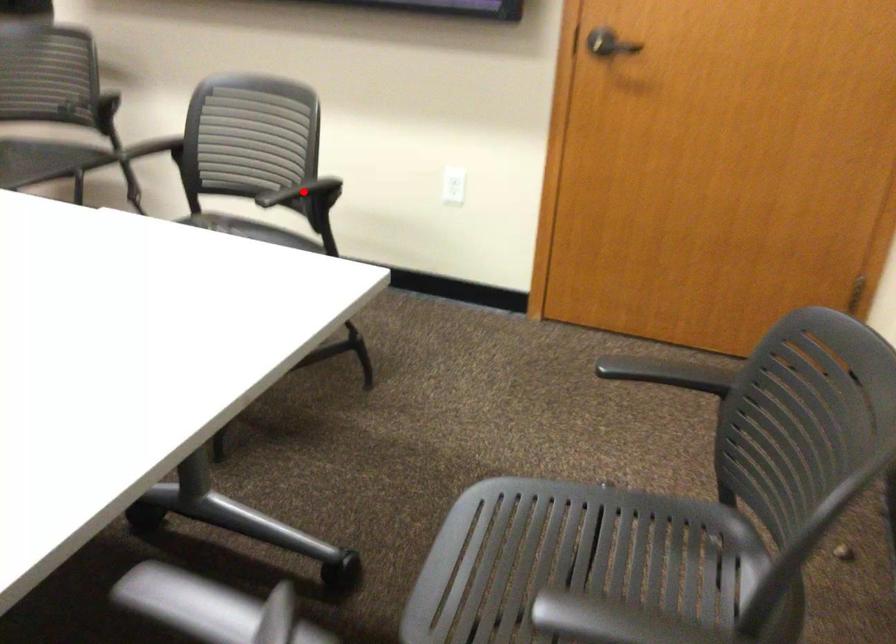
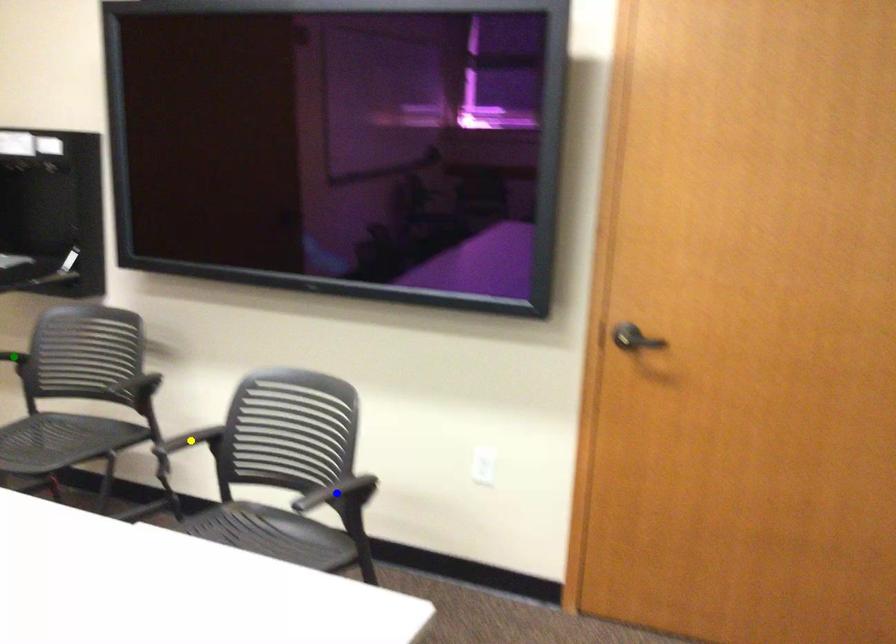
Question: I am providing you with two images of the same scene from different viewpoints. A red point is marked on the first image. You are given multiple points on the second image. Which point in image 2 is actually the same real-world point as the red point in image 1?

Choices:
 (A) blue point
 (B) yellow point
 (C) green point

Answer: (A)